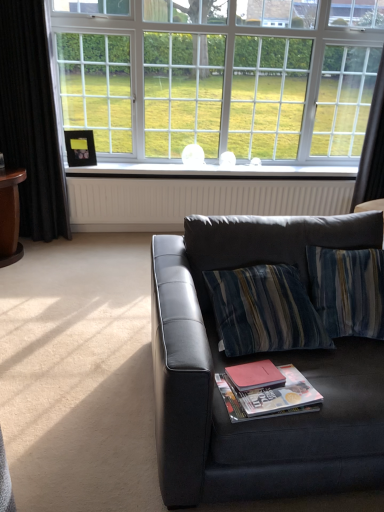
Where is `blank space situated above matte paper magazine at lower center (from a real-world perspective)`? The image size is (384, 512). blank space situated above matte paper magazine at lower center (from a real-world perspective) is located at coordinates (262, 380).